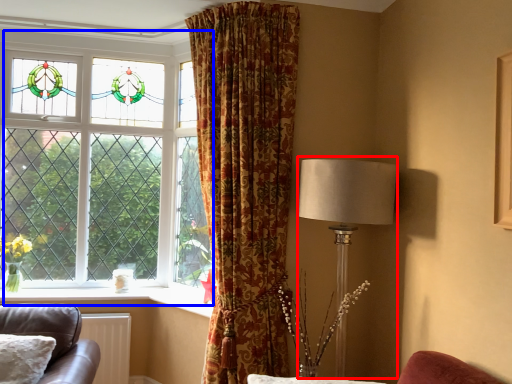
Question: Which object appears farthest to the camera in this image, table lamp (highlighted by a red box) or window (highlighted by a blue box)?

Choices:
 (A) table lamp
 (B) window

Answer: (B)